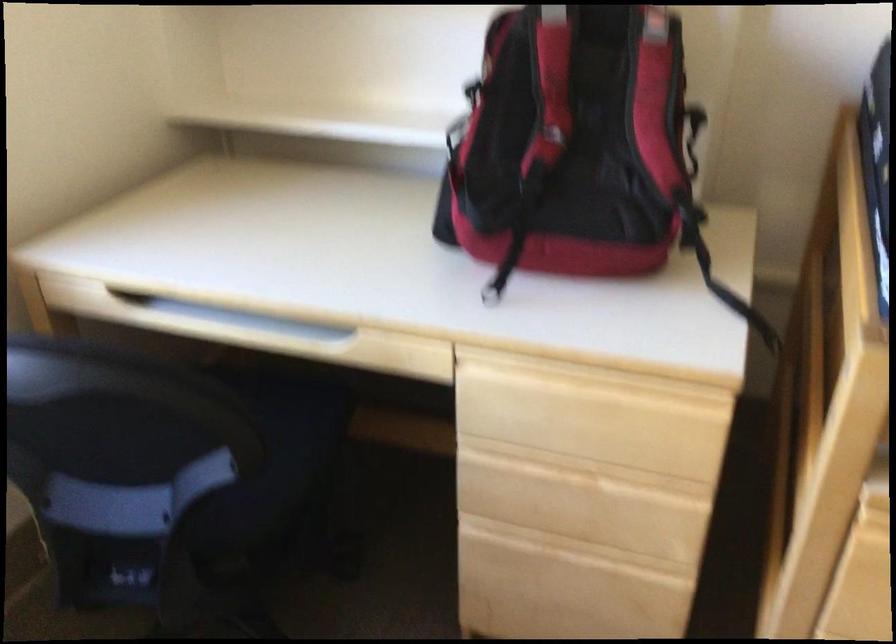
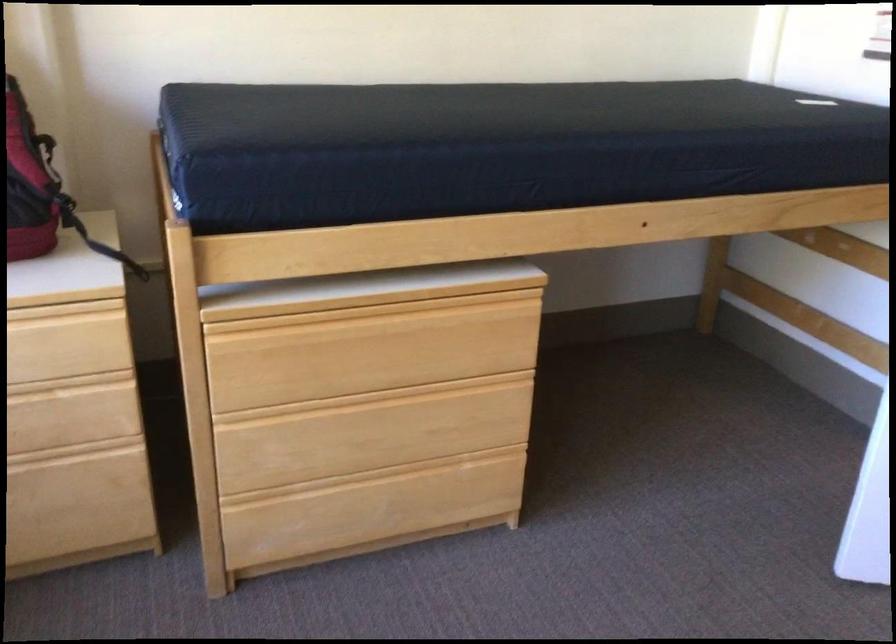
Question: The images are taken continuously from a first-person perspective. In which direction is your viewpoint rotating?

Choices:
 (A) Left
 (B) Right
 (C) Up
 (D) Down

Answer: (B)